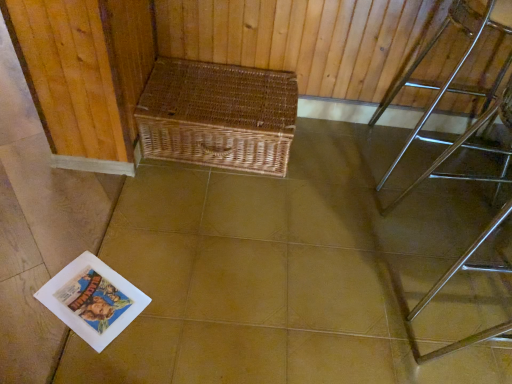
Locate an element on the screen. vacant space in front of woven brown picnic basket at center is located at coordinates (218, 228).